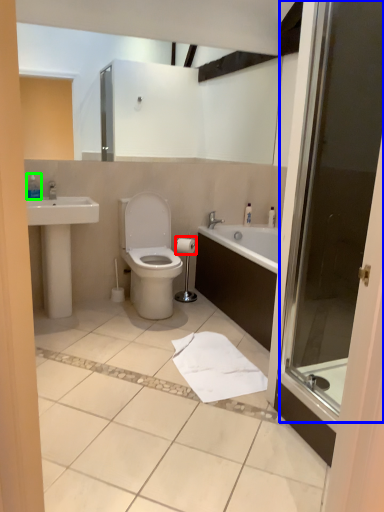
Question: Which object is the closest to the toilet paper (highlighted by a red box)? Choose among these: screen door (highlighted by a blue box) or toiletry (highlighted by a green box).

Choices:
 (A) screen door
 (B) toiletry

Answer: (B)